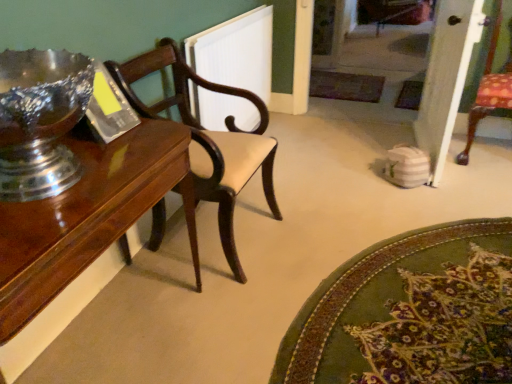
In order to click on vacant space in front of mahogany wood chair at left in this screenshot , I will do `click(232, 317)`.